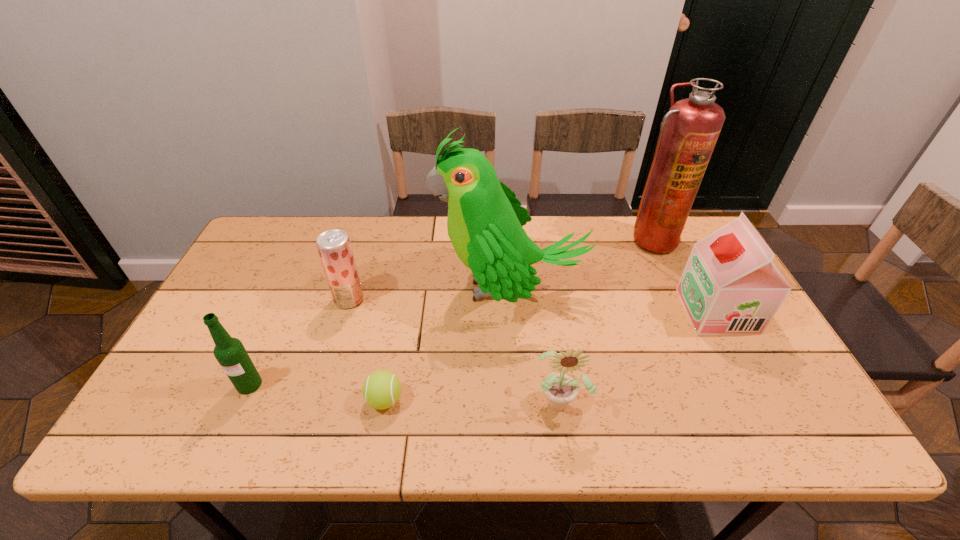
This screenshot has height=540, width=960. I want to click on sunflower at the near edge, so click(560, 389).

What are the coordinates of `tennis ball present at the near edge` in the screenshot? It's located at (381, 390).

I want to click on fire extinguisher that is positioned at the right edge, so click(x=689, y=131).

Locate an element on the screen. soya milk that is at the right edge is located at coordinates (730, 286).

You are a GUI agent. You are given a task and a screenshot of the screen. Output one action in this format:
    pyautogui.click(x=<x>, y=<y>)
    Task: Click on the object that is at the far right corner
    
    Given the screenshot: What is the action you would take?
    pyautogui.click(x=689, y=131)

Find the location of a particular element. This screenshot has height=540, width=960. vacant space at the far edge of the desktop is located at coordinates (432, 226).

Locate an element on the screen. vacant area at the near edge is located at coordinates (523, 430).

Identify the location of free region at the right edge. The height and width of the screenshot is (540, 960). (756, 372).

In the image, there is a desktop. Where is `free space at the far left corner`? The width and height of the screenshot is (960, 540). free space at the far left corner is located at coordinates (283, 217).

Find the location of a particular element. The height and width of the screenshot is (540, 960). vacant space at the near left corner of the desktop is located at coordinates (132, 440).